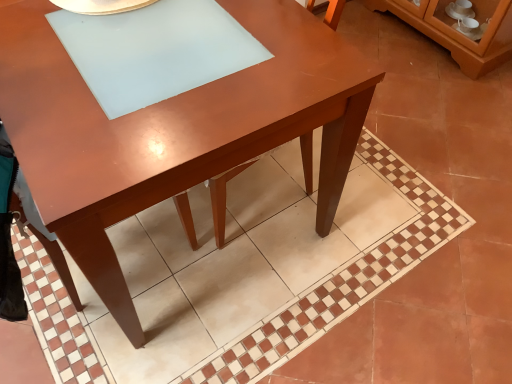
Question: Is matte brown table at center wider than brown glossy cabinet at upper right?

Choices:
 (A) yes
 (B) no

Answer: (A)

Question: Does matte brown table at center lie behind brown glossy cabinet at upper right?

Choices:
 (A) no
 (B) yes

Answer: (A)

Question: From a real-world perspective, is matte brown table at center beneath brown glossy cabinet at upper right?

Choices:
 (A) yes
 (B) no

Answer: (B)

Question: Does matte brown table at center appear on the left side of brown glossy cabinet at upper right?

Choices:
 (A) yes
 (B) no

Answer: (A)

Question: Is matte brown table at center thinner than brown glossy cabinet at upper right?

Choices:
 (A) no
 (B) yes

Answer: (A)

Question: From the image's perspective, is matte brown table at center beneath brown glossy cabinet at upper right?

Choices:
 (A) yes
 (B) no

Answer: (A)

Question: Considering the relative sizes of brown glossy cabinet at upper right and matte brown table at center in the image provided, is brown glossy cabinet at upper right smaller than matte brown table at center?

Choices:
 (A) yes
 (B) no

Answer: (A)

Question: Is brown glossy cabinet at upper right oriented towards matte brown table at center?

Choices:
 (A) no
 (B) yes

Answer: (B)

Question: From a real-world perspective, does brown glossy cabinet at upper right sit lower than matte brown table at center?

Choices:
 (A) yes
 (B) no

Answer: (A)

Question: Is brown glossy cabinet at upper right directly adjacent to matte brown table at center?

Choices:
 (A) no
 (B) yes

Answer: (A)

Question: Does brown glossy cabinet at upper right appear on the right side of matte brown table at center?

Choices:
 (A) yes
 (B) no

Answer: (A)

Question: From the image's perspective, does brown glossy cabinet at upper right appear lower than matte brown table at center?

Choices:
 (A) no
 (B) yes

Answer: (A)

Question: Is matte brown table at center bigger or smaller than brown glossy cabinet at upper right?

Choices:
 (A) big
 (B) small

Answer: (A)